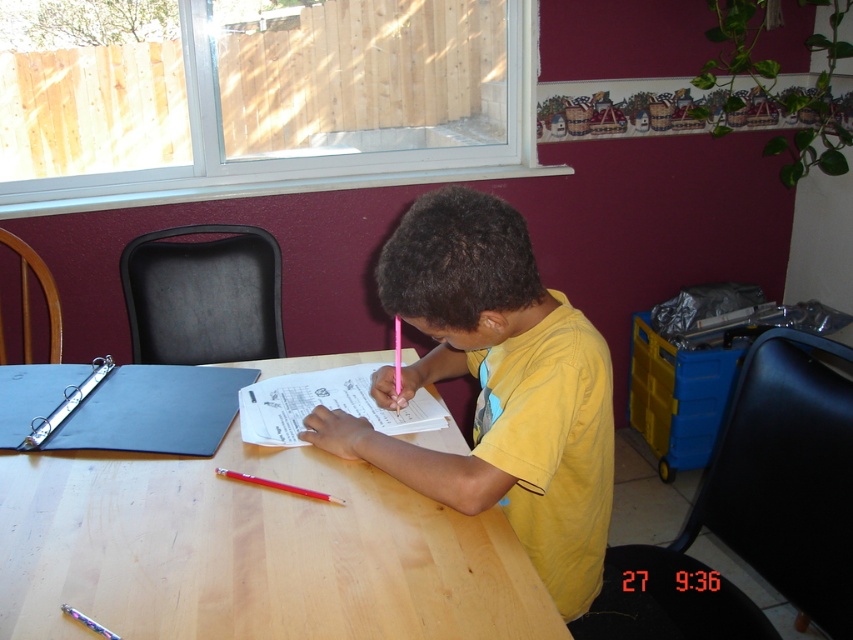
You are a teacher observing a student working at a desk. The student is using a pencil, but you notice a point at coordinates (155,410) on the blue fabric binder at upper left. What object is located at that specific coordinate?

The point at coordinates (155,410) is located on the blue fabric binder at upper left.

You are a photographer standing at a certain distance from the boy. You want to take a closeup shot of the yellow matte shirt at center without moving the camera. Is the current distance sufficient for capturing the shirt in focus?

The yellow matte shirt at center is 38.73 inches away from the camera. Since the photographer cannot move the camera, the current distance may not be ideal for a closeup shot as it might be too far for the camera lens to focus effectively on such a small subject without zooming or adjusting settings.

You are a teacher observing a student working on a project. The student is sitting at the light brown wood table at center and has the white paper at center in front of them. Which object is positioned to the left of the other?

The light brown wood table at center is to the left of white paper at center.